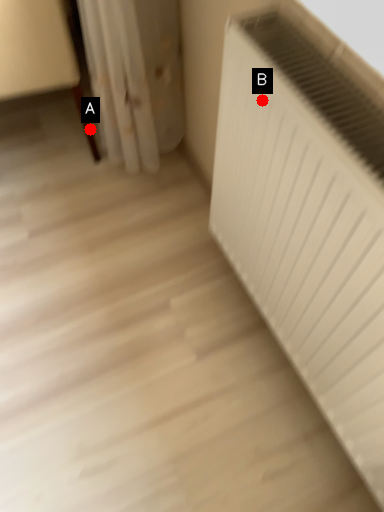
Question: Two points are circled on the image, labeled by A and B beside each circle. Which point is closer to the camera?

Choices:
 (A) A is closer
 (B) B is closer

Answer: (B)